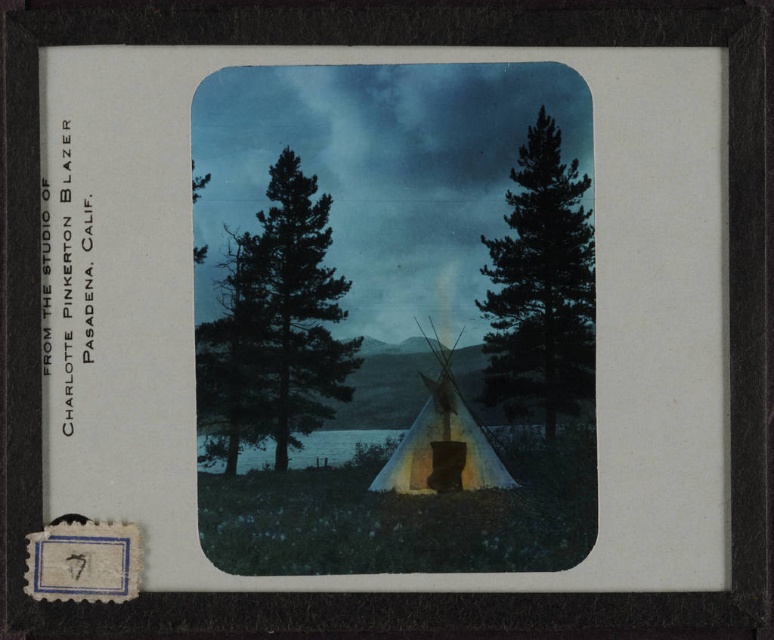
You are an observer standing at the edge of this outdoor scene. You notice the green matte tree at center and the blue water at center. Which object appears taller from your viewpoint?

The green matte tree at center appears taller than the blue water at center from your viewpoint.